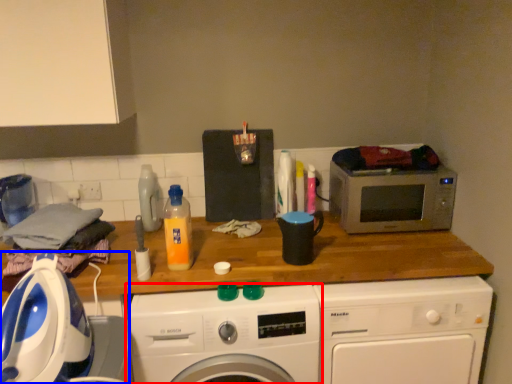
Question: Which point is closer to the camera, washing machine (highlighted by a red box) or washing machine (highlighted by a blue box)?

Choices:
 (A) washing machine
 (B) washing machine

Answer: (B)